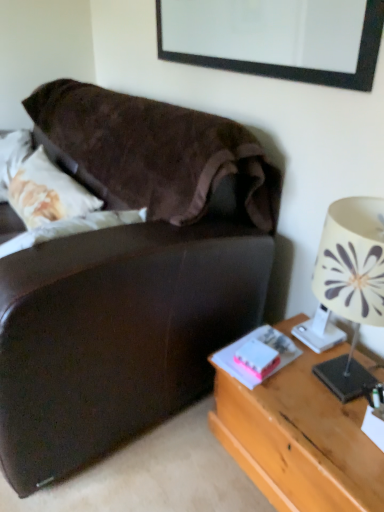
Describe the element at coordinates (259, 343) in the screenshot. I see `pink matte book at lower right, which ranks as the first book in right-to-left order` at that location.

In order to face white matte book at lower right, the 1th book viewed from the left, should I rotate leftwards or rightwards?

You should look right and rotate roughly 9.192 degrees.

Measure the distance between point (354, 412) and camera.

Point (354, 412) and camera are 3.41 feet apart.

Where is `pink matte book at lower right, which ranks as the first book in right-to-left order`? The height and width of the screenshot is (512, 384). pink matte book at lower right, which ranks as the first book in right-to-left order is located at coordinates (259, 343).

Are white fabric lampshade at right and pink matte book at lower right, which ranks as the first book in right-to-left order, making contact?

No, white fabric lampshade at right is not touching pink matte book at lower right, which ranks as the first book in right-to-left order.

Does point (369, 283) lie behind point (233, 362)?

No, (369, 283) is in front of (233, 362).

Is white fabric lampshade at right further to the viewer compared to pink matte book at lower right, which ranks as the first book in right-to-left order?

No, it is in front of pink matte book at lower right, which ranks as the first book in right-to-left order.

In order to click on lamp to the right of black matte picture frame at upper center in this screenshot , I will do `click(347, 288)`.

Could you tell me if white fabric lampshade at right is turned towards black matte picture frame at upper center?

No, white fabric lampshade at right is not oriented towards black matte picture frame at upper center.

From a real-world perspective, between white fabric lampshade at right and black matte picture frame at upper center, who is vertically lower?

In real-world perspective, white fabric lampshade at right is lower.

Would you say white matte book at lower right, the 1th book viewed from the left, is part of wooden desk at right's contents?

No, white matte book at lower right, the 1th book viewed from the left, is not surrounded by wooden desk at right.

In terms of size, does wooden desk at right appear bigger or smaller than white matte book at lower right, which is the second book from right to left?

Considering their sizes, wooden desk at right takes up more space than white matte book at lower right, which is the second book from right to left.

Locate an element on the screen. desk that is in front of the white matte book at lower right, the 1th book viewed from the left is located at coordinates (300, 439).

Is wooden desk at right taller or shorter than white matte book at lower right, the 1th book viewed from the left?

Clearly, wooden desk at right is taller compared to white matte book at lower right, the 1th book viewed from the left.

Between black matte picture frame at upper center and white matte book at lower right, the 1th book viewed from the left, which one is positioned behind?

Positioned behind is white matte book at lower right, the 1th book viewed from the left.

Can we say black matte picture frame at upper center lies outside white matte book at lower right, the 1th book viewed from the left?

Yes.

Consider the image. In terms of width, does black matte picture frame at upper center look wider or thinner when compared to white matte book at lower right, the 1th book viewed from the left?

black matte picture frame at upper center is thinner than white matte book at lower right, the 1th book viewed from the left.

Does black matte picture frame at upper center lie behind pink matte book at lower right, which ranks as the first book in right-to-left order?

No, black matte picture frame at upper center is closer to the viewer.

Based on the photo, is black matte picture frame at upper center beside pink matte book at lower right, which ranks as the first book in right-to-left order?

They are not placed beside each other.

Considering the relative sizes of black matte picture frame at upper center and pink matte book at lower right, acting as the second book starting from the left, in the image provided, is black matte picture frame at upper center wider than pink matte book at lower right, acting as the second book starting from the left,?

Incorrect, the width of black matte picture frame at upper center does not surpass that of pink matte book at lower right, acting as the second book starting from the left.

From the image's perspective, is black matte picture frame at upper center on top of pink matte book at lower right, which ranks as the first book in right-to-left order?

Yes, from the image's perspective, black matte picture frame at upper center is above pink matte book at lower right, which ranks as the first book in right-to-left order.

Considering the sizes of objects white fabric lampshade at right and white matte book at lower right, which is the second book from right to left, in the image provided, who is taller, white fabric lampshade at right or white matte book at lower right, which is the second book from right to left,?

white fabric lampshade at right is taller.

Where is `lamp on the right of white matte book at lower right, which is the second book from right to left`? lamp on the right of white matte book at lower right, which is the second book from right to left is located at coordinates (347, 288).

Consider the image. Is white fabric lampshade at right not near white matte book at lower right, which is the second book from right to left?

Actually, white fabric lampshade at right and white matte book at lower right, which is the second book from right to left, are a little close together.

Based on the photo, does white fabric lampshade at right come in front of white matte book at lower right, which is the second book from right to left?

Yes, the depth of white fabric lampshade at right is less than that of white matte book at lower right, which is the second book from right to left.

Locate an element on the screen. This screenshot has width=384, height=512. the 1st book positioned above the wooden desk at right (from a real-world perspective) is located at coordinates (259, 343).

Is wooden desk at right facing towards pink matte book at lower right, which ranks as the first book in right-to-left order?

No, wooden desk at right does not turn towards pink matte book at lower right, which ranks as the first book in right-to-left order.

In the scene shown: Is wooden desk at right positioned beyond the bounds of pink matte book at lower right, acting as the second book starting from the left?

Yes, wooden desk at right is located beyond the bounds of pink matte book at lower right, acting as the second book starting from the left.

Between wooden desk at right and pink matte book at lower right, acting as the second book starting from the left, which one appears on the left side from the viewer's perspective?

From the viewer's perspective, pink matte book at lower right, acting as the second book starting from the left, appears more on the left side.

Image resolution: width=384 pixels, height=512 pixels. What are the coordinates of `lamp located above the pink matte book at lower right, which ranks as the first book in right-to-left order (from a real-world perspective)` in the screenshot? It's located at (347, 288).

You are a GUI agent. You are given a task and a screenshot of the screen. Output one action in this format:
    pyautogui.click(x=<x>, y=<y>)
    Task: Click on the lamp located below the black matte picture frame at upper center (from the image's perspective)
    The width and height of the screenshot is (384, 512).
    Given the screenshot: What is the action you would take?
    pyautogui.click(x=347, y=288)

From the image, which object appears to be nearer to white matte book at lower right, which is the second book from right to left, wooden desk at right or black matte picture frame at upper center?

wooden desk at right is closer to white matte book at lower right, which is the second book from right to left.

From the image, which object appears to be farther from white fabric lampshade at right, black matte picture frame at upper center or wooden desk at right?

black matte picture frame at upper center is positioned further to the anchor white fabric lampshade at right.

Based on their spatial positions, is black matte picture frame at upper center or white matte book at lower right, which is the second book from right to left, closer to pink matte book at lower right, acting as the second book starting from the left?

white matte book at lower right, which is the second book from right to left, is positioned closer to the anchor pink matte book at lower right, acting as the second book starting from the left.

Estimate the real-world distances between objects in this image. Which object is closer to pink matte book at lower right, acting as the second book starting from the left, white matte book at lower right, which is the second book from right to left, or white fabric lampshade at right?

The object closer to pink matte book at lower right, acting as the second book starting from the left, is white matte book at lower right, which is the second book from right to left.

From the image, which object appears to be farther from white fabric lampshade at right, pink matte book at lower right, acting as the second book starting from the left, or wooden desk at right?

wooden desk at right is further to white fabric lampshade at right.

Looking at the image, which one is located further to white fabric lampshade at right, black matte picture frame at upper center or white matte book at lower right, which is the second book from right to left?

black matte picture frame at upper center is further to white fabric lampshade at right.

Based on their spatial positions, is wooden desk at right or pink matte book at lower right, which ranks as the first book in right-to-left order, closer to black matte picture frame at upper center?

pink matte book at lower right, which ranks as the first book in right-to-left order, is closer to black matte picture frame at upper center.

Considering their positions, is wooden desk at right positioned further to black matte picture frame at upper center than white matte book at lower right, the 1th book viewed from the left?

Based on the image, wooden desk at right appears to be further to black matte picture frame at upper center.

The height and width of the screenshot is (512, 384). I want to click on book between black matte picture frame at upper center and pink matte book at lower right, which ranks as the first book in right-to-left order, from top to bottom, so click(x=257, y=358).

At what (x,y) coordinates should I click in order to perform the action: click on lamp between black matte picture frame at upper center and wooden desk at right vertically. Please return your answer as a coordinate pair (x, y). The width and height of the screenshot is (384, 512). Looking at the image, I should click on (347, 288).

Identify the location of book positioned between wooden desk at right and pink matte book at lower right, which ranks as the first book in right-to-left order, from near to far. (257, 358).

Identify the location of desk positioned between white fabric lampshade at right and pink matte book at lower right, acting as the second book starting from the left, from near to far. (300, 439).